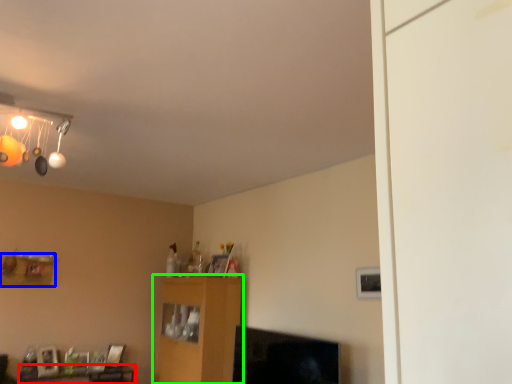
Question: Which is nearer to the table (highlighted by a red box)? shelf (highlighted by a blue box) or furniture (highlighted by a green box).

Choices:
 (A) shelf
 (B) furniture

Answer: (A)